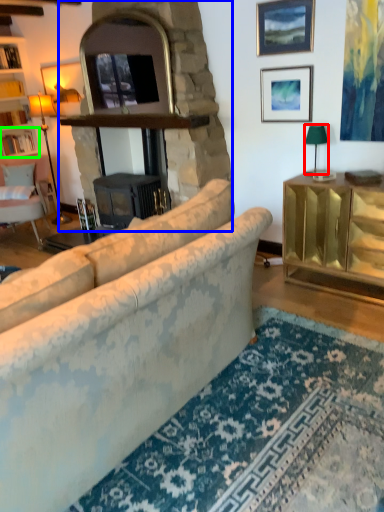
Question: Which object is positioned farthest from lamp (highlighted by a red box)? Select from fireplace (highlighted by a blue box) and shelf (highlighted by a green box).

Choices:
 (A) fireplace
 (B) shelf

Answer: (B)